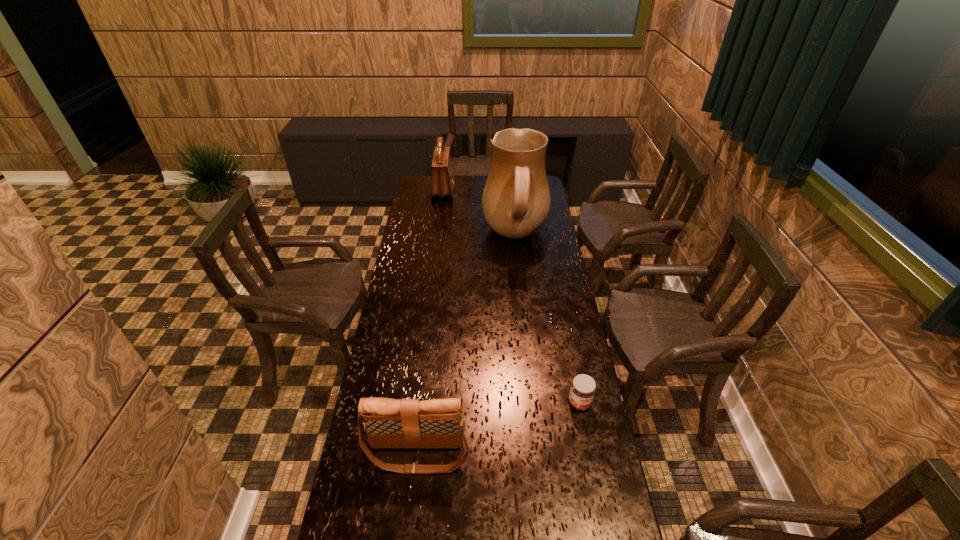
The height and width of the screenshot is (540, 960). In order to click on cream pitcher in this screenshot , I will do `click(516, 200)`.

Find the location of a particular element. Image resolution: width=960 pixels, height=540 pixels. the tallest object is located at coordinates (516, 200).

You are a GUI agent. You are given a task and a screenshot of the screen. Output one action in this format:
    pyautogui.click(x=<x>, y=<y>)
    Task: Click on the third shortest object
    The image size is (960, 540).
    Given the screenshot: What is the action you would take?
    pyautogui.click(x=442, y=178)

Where is `the farther shoulder bag`? This screenshot has height=540, width=960. the farther shoulder bag is located at coordinates (442, 178).

Image resolution: width=960 pixels, height=540 pixels. I want to click on the third tallest object, so click(x=390, y=423).

Where is `the nearest object`? This screenshot has width=960, height=540. the nearest object is located at coordinates coord(390,423).

Find the location of a particular element. The image size is (960, 540). the third farthest object is located at coordinates tap(583, 387).

Image resolution: width=960 pixels, height=540 pixels. I want to click on the shortest object, so click(583, 387).

Where is `free space located at the spout of the tallest object`? free space located at the spout of the tallest object is located at coordinates (407, 236).

The image size is (960, 540). In order to click on free space located 0.050m at the spout of the tallest object in this screenshot , I will do `click(472, 236)`.